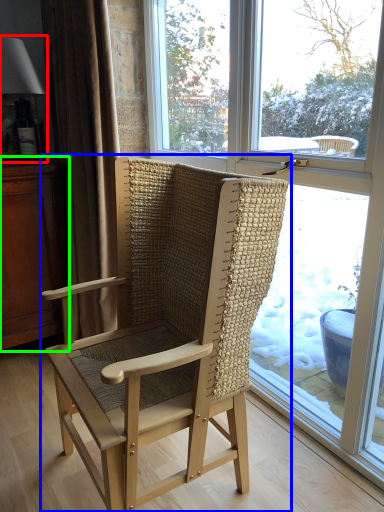
Question: Which object is the closest to the lamp (highlighted by a red box)? Choose among these: chair (highlighted by a blue box) or dresser (highlighted by a green box).

Choices:
 (A) chair
 (B) dresser

Answer: (B)